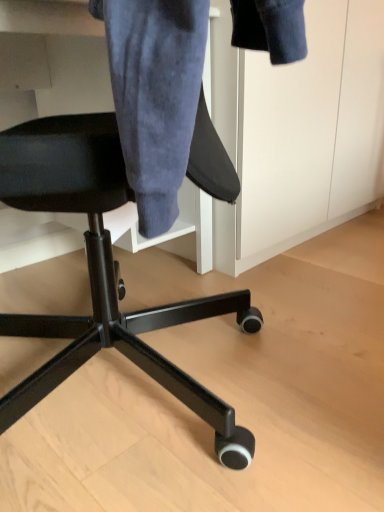
Locate an element on the screen. unoccupied region to the right of black fabric chair at center is located at coordinates (318, 345).